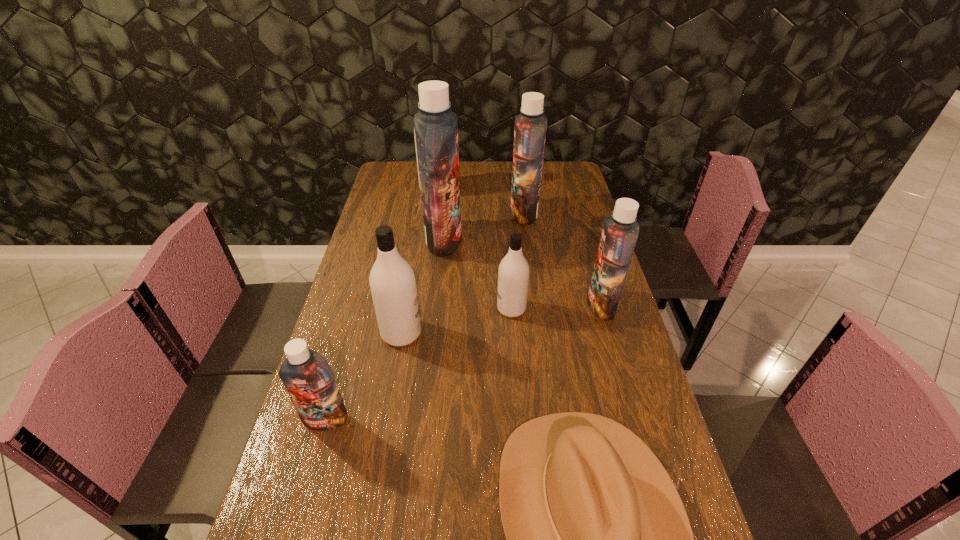
Image resolution: width=960 pixels, height=540 pixels. I want to click on blue shampoo that is the third closest to the leftmost blue shampoo, so click(530, 125).

Where is `blue shampoo identified as the third closest to the second blue shampoo from left to right`? This screenshot has height=540, width=960. blue shampoo identified as the third closest to the second blue shampoo from left to right is located at coordinates (309, 380).

Locate an element on the screen. The width and height of the screenshot is (960, 540). white shampoo that is the second nearest to the cowboy hat is located at coordinates (513, 274).

You are a GUI agent. You are given a task and a screenshot of the screen. Output one action in this format:
    pyautogui.click(x=<x>, y=<y>)
    Task: Click on the white shampoo that stands as the second closest to the second biggest blue shampoo
    The height and width of the screenshot is (540, 960).
    Given the screenshot: What is the action you would take?
    pyautogui.click(x=513, y=274)

The height and width of the screenshot is (540, 960). I want to click on free space that satisfies the following two spatial constraints: 1. on the front label of the rightmost blue shampoo; 2. on the front label of the leftmost object, so click(x=635, y=419).

Find the location of `free space that satisfies the following two spatial constraints: 1. on the front-facing side of the farthest object; 2. on the front-facing side of the second biggest white shampoo`. free space that satisfies the following two spatial constraints: 1. on the front-facing side of the farthest object; 2. on the front-facing side of the second biggest white shampoo is located at coordinates (418, 333).